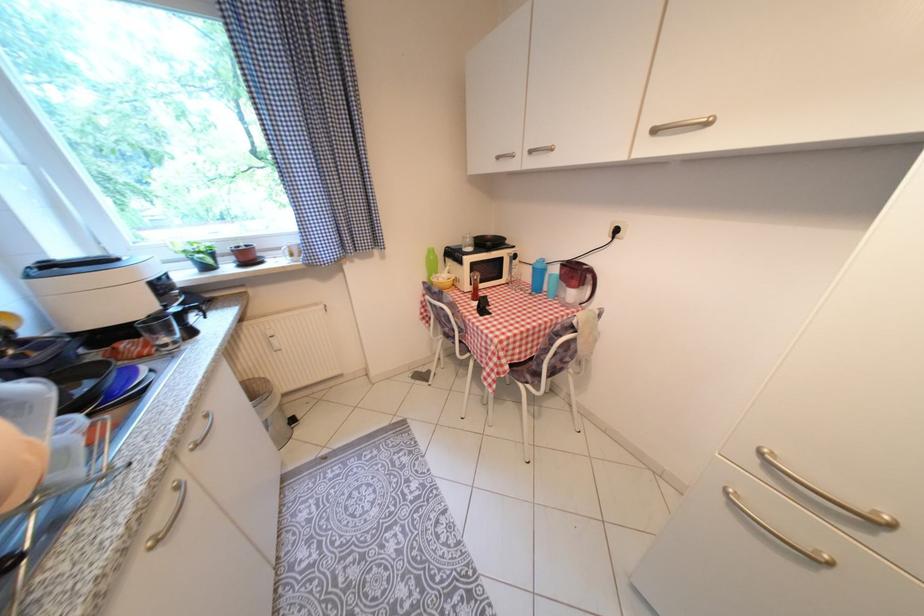
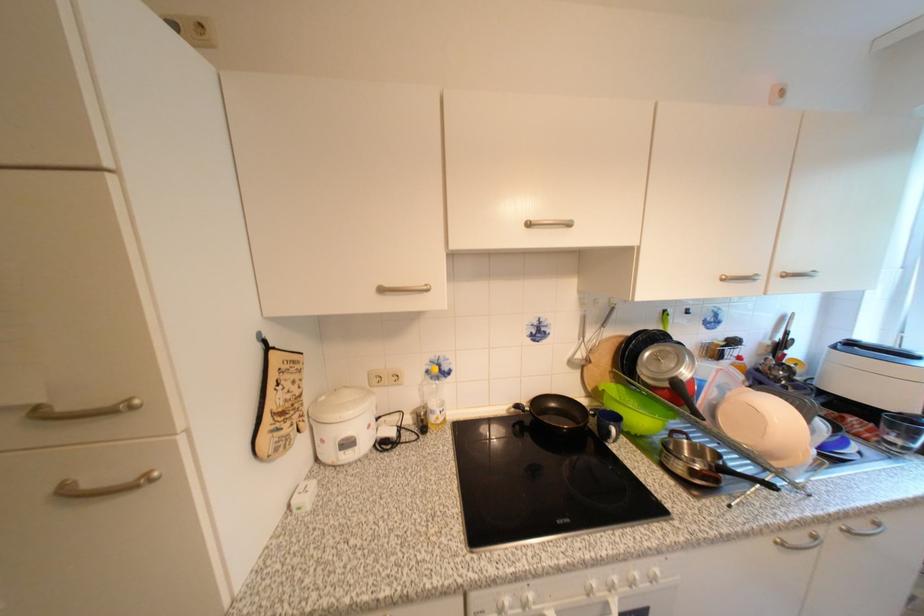
Looking at this image, the images are taken continuously from a first-person perspective. In which direction is your viewpoint rotating?

The rotation direction of the camera is left-down.